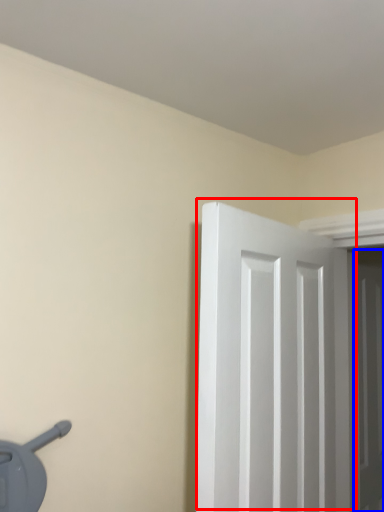
Question: Which point is further to the camera, door (highlighted by a red box) or door (highlighted by a blue box)?

Choices:
 (A) door
 (B) door

Answer: (B)